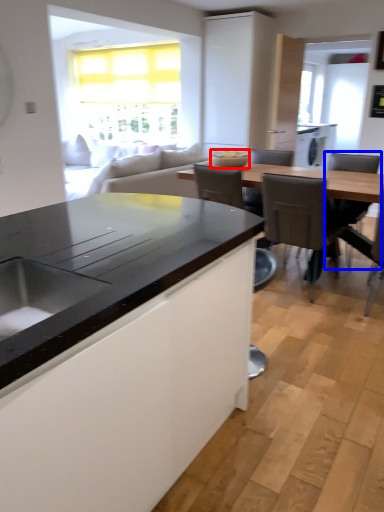
Question: Which object is closer to the camera taking this photo, appliance (highlighted by a red box) or chair (highlighted by a blue box)?

Choices:
 (A) appliance
 (B) chair

Answer: (B)